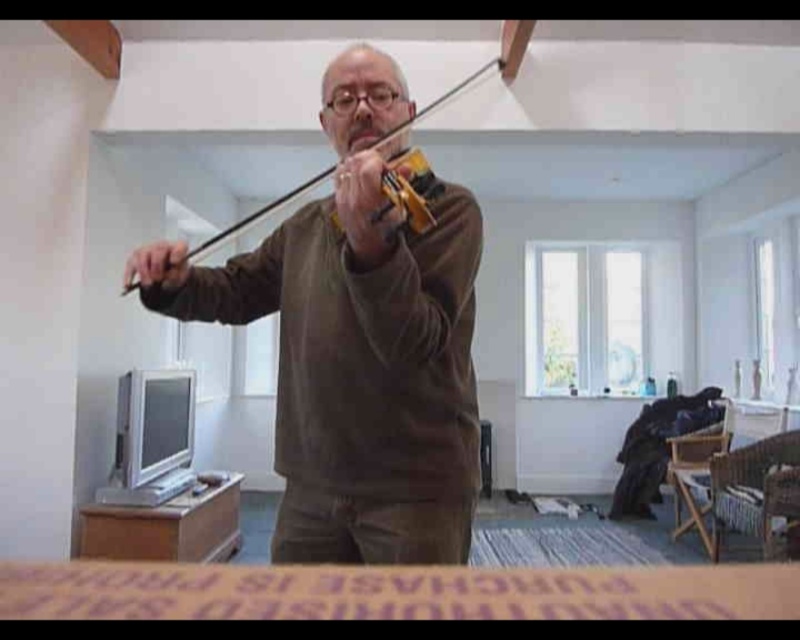
Question: Does brown velvet violin at center appear over wooden violin at center?

Choices:
 (A) yes
 (B) no

Answer: (B)

Question: Which object is closer to the camera taking this photo?

Choices:
 (A) brown velvet violin at center
 (B) wooden violin at center

Answer: (A)

Question: Can you confirm if brown velvet violin at center is smaller than wooden violin at center?

Choices:
 (A) no
 (B) yes

Answer: (A)

Question: In this image, where is brown velvet violin at center located relative to wooden violin at center?

Choices:
 (A) right
 (B) left

Answer: (A)